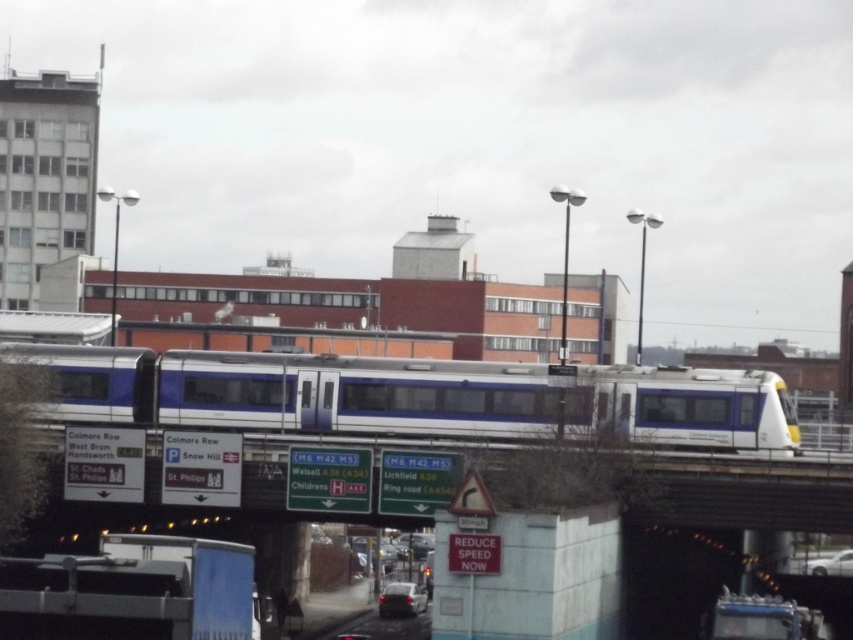
Can you confirm if white plastic signboard at upper center is positioned to the left of metallic silver car at center?

In fact, white plastic signboard at upper center is to the right of metallic silver car at center.

Who is shorter, white plastic signboard at upper center or metallic silver car at center?

With less height is metallic silver car at center.

Measure the distance between point (39, 432) and camera.

Point (39, 432) is 177.68 feet from camera.

The height and width of the screenshot is (640, 853). I want to click on white plastic signboard at upper center, so click(x=741, y=490).

Is white glossy train at center shorter than white plastic signboard at upper center?

Incorrect, white glossy train at center's height does not fall short of white plastic signboard at upper center's.

Image resolution: width=853 pixels, height=640 pixels. In order to click on white glossy train at center in this screenshot , I will do `click(415, 396)`.

Between white glossy train at center and silver metallic sedan at center, which one has more height?

white glossy train at center

The height and width of the screenshot is (640, 853). What do you see at coordinates (415, 396) in the screenshot? I see `white glossy train at center` at bounding box center [415, 396].

Find the location of `white glossy train at center`. white glossy train at center is located at coordinates (415, 396).